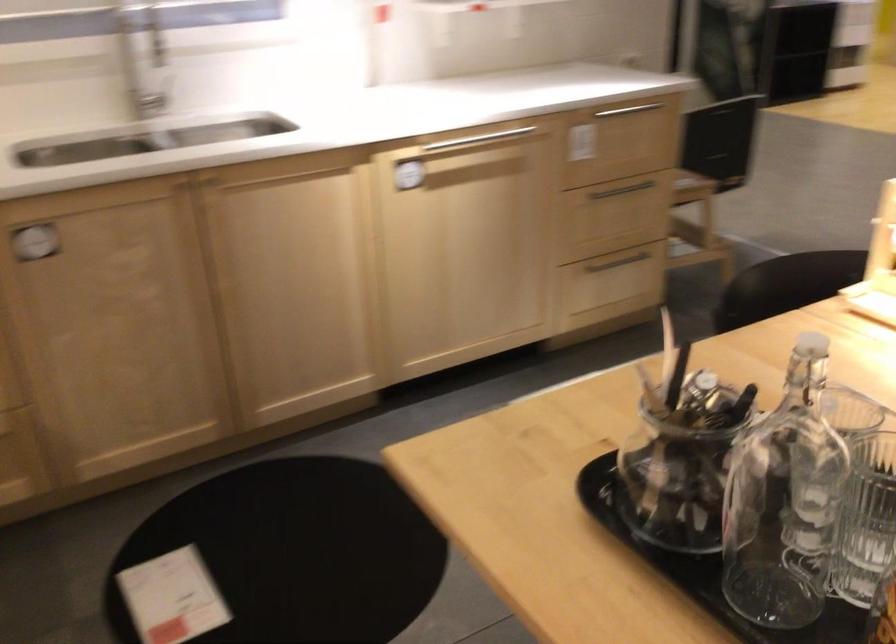
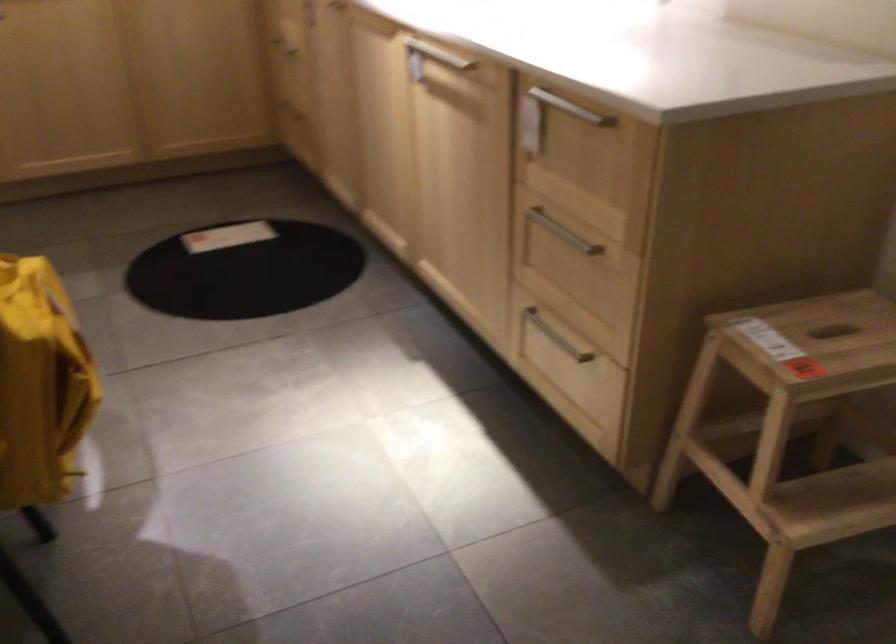
In the second image, find the point that corresponds to pixel 437 153 in the first image.

(428, 59)